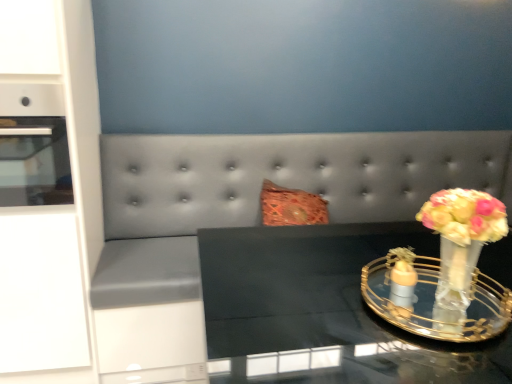
Question: Choose the correct answer: Is matte orange glass candle holder at right, the 2th candle holder from the right, inside translucent glass vase at right or outside it?

Choices:
 (A) inside
 (B) outside

Answer: (A)

Question: Relative to translucent glass vase at right, is matte orange glass candle holder at right, the 1th candle holder positioned from the left, in front or behind?

Choices:
 (A) front
 (B) behind

Answer: (B)

Question: Estimate the real-world distances between objects in this image. Which object is closer to the black glass table at center?

Choices:
 (A) translucent glass vase at right
 (B) suede gray couch at center
 (C) matte orange glass candle holder at right, the 2th candle holder from the right
 (D) white glossy cabinet at left
 (E) clear glass vase at right, which is counted as the first candle holder, starting from the right

Answer: (E)

Question: Estimate the real-world distances between objects in this image. Which object is closer to the suede gray couch at center?

Choices:
 (A) black glass table at center
 (B) matte orange glass candle holder at right, the 2th candle holder from the right
 (C) clear glass vase at right, the 2th candle holder from the left
 (D) translucent glass vase at right
 (E) white glossy cabinet at left

Answer: (E)